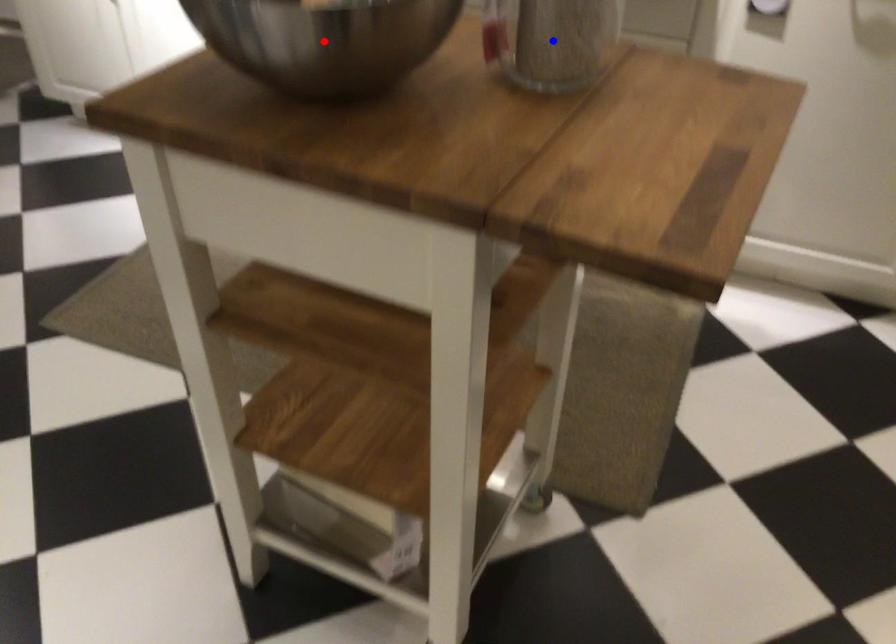
Question: Two points are marked on the image. Which point is closer to the camera?

Choices:
 (A) Blue point is closer.
 (B) Red point is closer.

Answer: (B)